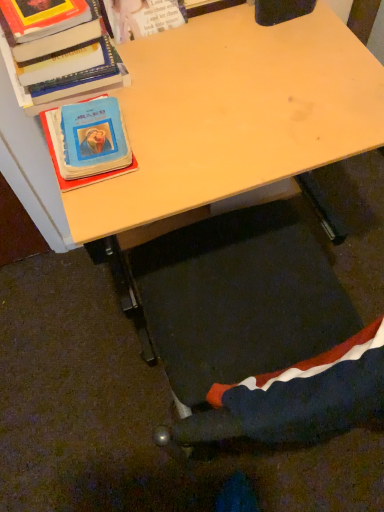
Question: Is velvet-like fabric swivel chair at lower center a part of blue matte book at left, the first book when ordered from bottom to top?

Choices:
 (A) no
 (B) yes

Answer: (A)

Question: Is blue matte book at left, arranged as the 2th book when viewed from the top, with velvet-like fabric swivel chair at lower center?

Choices:
 (A) yes
 (B) no

Answer: (B)

Question: Are blue matte book at left, arranged as the 2th book when viewed from the top, and velvet-like fabric swivel chair at lower center far apart?

Choices:
 (A) no
 (B) yes

Answer: (A)

Question: From a real-world perspective, is blue matte book at left, arranged as the 2th book when viewed from the top, beneath velvet-like fabric swivel chair at lower center?

Choices:
 (A) yes
 (B) no

Answer: (B)

Question: Is velvet-like fabric swivel chair at lower center at the back of blue matte book at left, the first book when ordered from bottom to top?

Choices:
 (A) no
 (B) yes

Answer: (A)

Question: Is blue matte book at left, arranged as the 2th book when viewed from the top, not within velvet-like fabric swivel chair at lower center?

Choices:
 (A) no
 (B) yes

Answer: (B)

Question: Is wooden desk at center further to camera compared to hardcover book at upper left, which is the second book in bottom-to-top order?

Choices:
 (A) yes
 (B) no

Answer: (B)

Question: Does wooden desk at center appear on the left side of hardcover book at upper left, which is the second book in bottom-to-top order?

Choices:
 (A) yes
 (B) no

Answer: (B)

Question: Considering the relative positions of wooden desk at center and hardcover book at upper left, which is the second book in bottom-to-top order, in the image provided, is wooden desk at center to the right of hardcover book at upper left, which is the second book in bottom-to-top order, from the viewer's perspective?

Choices:
 (A) no
 (B) yes

Answer: (B)

Question: Is wooden desk at center facing away from hardcover book at upper left, arranged as the first book when viewed from the top?

Choices:
 (A) no
 (B) yes

Answer: (A)

Question: Does wooden desk at center have a greater height compared to hardcover book at upper left, arranged as the first book when viewed from the top?

Choices:
 (A) no
 (B) yes

Answer: (B)

Question: Can you confirm if wooden desk at center is thinner than hardcover book at upper left, arranged as the first book when viewed from the top?

Choices:
 (A) yes
 (B) no

Answer: (B)

Question: Are velvet-like fabric swivel chair at lower center and blue matte book at left, arranged as the 2th book when viewed from the top, located far from each other?

Choices:
 (A) no
 (B) yes

Answer: (A)